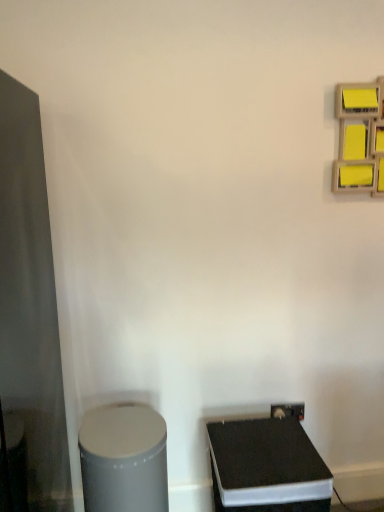
Question: Considering the positions of matte black glass door at left and black matte speaker at lower right, which appears as the first wide when viewed from the right, in the image, is matte black glass door at left bigger or smaller than black matte speaker at lower right, which appears as the first wide when viewed from the right,?

Choices:
 (A) small
 (B) big

Answer: (B)

Question: Relative to black matte speaker at lower right, which is the second wide from left to right, is matte black glass door at left in front or behind?

Choices:
 (A) front
 (B) behind

Answer: (A)

Question: Estimate the real-world distances between objects in this image. Which object is closer to the satin silver trash can at lower left, the first wide in the left-to-right sequence?

Choices:
 (A) black matte speaker at lower right, which appears as the first wide when viewed from the right
 (B) yellow matte sticky notes at upper right
 (C) matte black glass door at left

Answer: (A)

Question: Based on their relative distances, which object is farther from the yellow matte sticky notes at upper right?

Choices:
 (A) satin silver trash can at lower left, the second wide positioned from the right
 (B) black matte speaker at lower right, which appears as the first wide when viewed from the right
 (C) matte black glass door at left

Answer: (A)